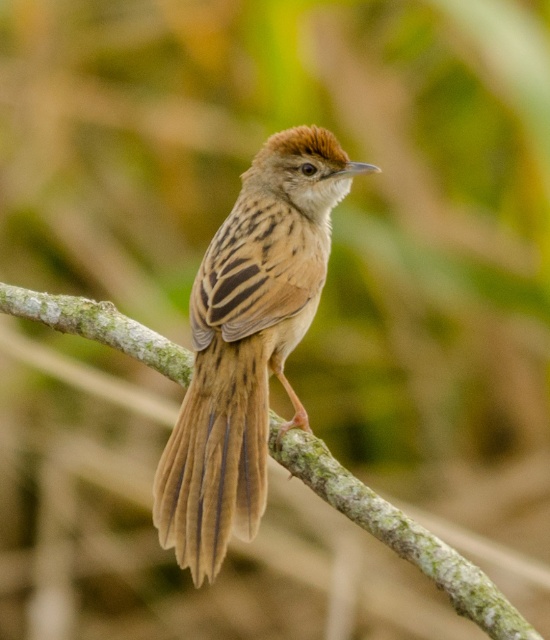
Between point (265, 368) and point (141, 339), which one is positioned behind?

The point (141, 339) is more distant.

Locate an element on the screen. The image size is (550, 640). brown feathered sparrow at center is located at coordinates (248, 342).